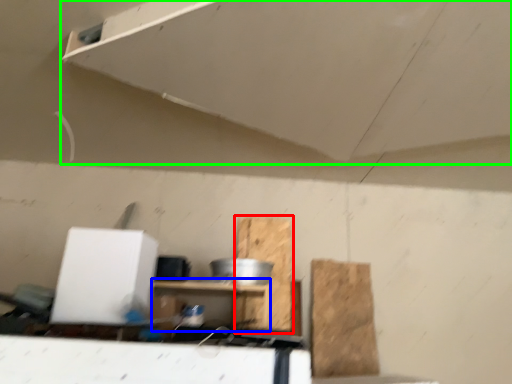
Question: Which is farther away from cardboard (highlighted by a red box)? furniture (highlighted by a blue box) or exhaust hood (highlighted by a green box)?

Choices:
 (A) furniture
 (B) exhaust hood

Answer: (B)